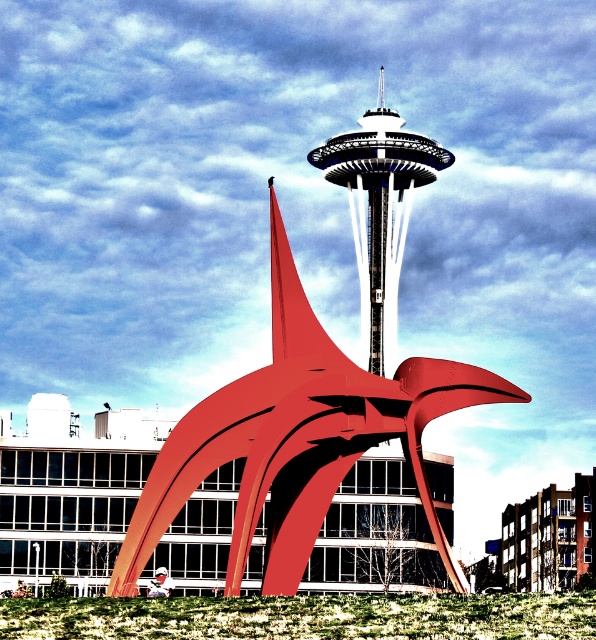
How distant is metallic red sculpture at center from green grass at lower center?

23.64 feet

Does point (371, 378) lie in front of point (226, 627)?

No, it is not.

What do you see at coordinates (298, 438) in the screenshot?
I see `metallic red sculpture at center` at bounding box center [298, 438].

Where is `metallic red sculpture at center`? metallic red sculpture at center is located at coordinates (298, 438).

Between green grass at lower center and white glossy space needle at center, which one appears on the left side from the viewer's perspective?

From the viewer's perspective, green grass at lower center appears more on the left side.

Does green grass at lower center have a greater height compared to white glossy space needle at center?

Incorrect, green grass at lower center's height is not larger of white glossy space needle at center's.

Does point (4, 634) come farther from viewer compared to point (381, 232)?

No, (4, 634) is closer to viewer.

Find the location of a particular element. This screenshot has width=596, height=640. green grass at lower center is located at coordinates (305, 618).

Does metallic red sculpture at center appear under white glossy space needle at center?

Yes, metallic red sculpture at center is below white glossy space needle at center.

Is point (156, 460) farther from camera compared to point (383, 317)?

No, it is in front of (383, 317).

Where is `metallic red sculpture at center`? metallic red sculpture at center is located at coordinates (298, 438).